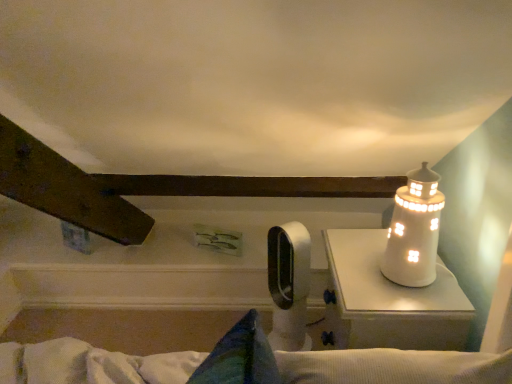
Locate an element on the screen. free point behind white ceramic lighthouse at upper right is located at coordinates (360, 247).